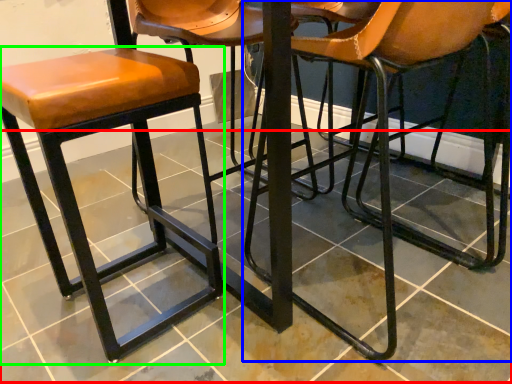
Question: Estimate the real-world distances between objects in this image. Which object is farther from tile (highlighted by a red box), chair (highlighted by a blue box) or stool (highlighted by a green box)?

Choices:
 (A) chair
 (B) stool

Answer: (A)